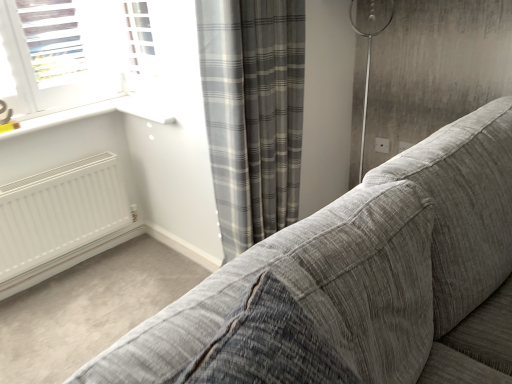
The width and height of the screenshot is (512, 384). What do you see at coordinates (382, 145) in the screenshot?
I see `matte gray outlet at upper center` at bounding box center [382, 145].

Describe the element at coordinates (253, 113) in the screenshot. The height and width of the screenshot is (384, 512). I see `gray plaid curtain at center` at that location.

You are a GUI agent. You are given a task and a screenshot of the screen. Output one action in this format:
    pyautogui.click(x=<x>, y=<y>)
    Task: Click on the textured gray fabric couch at center
    This screenshot has width=512, height=384.
    Given the screenshot: What is the action you would take?
    pyautogui.click(x=357, y=283)

From the picture: Measure the distance between gray plaid curtain at center and textured gray fabric couch at center.

gray plaid curtain at center is 79.45 centimeters from textured gray fabric couch at center.

Which is more to the right, gray plaid curtain at center or textured gray fabric couch at center?

From the viewer's perspective, gray plaid curtain at center appears more on the right side.

Which is nearer, (x=261, y=91) or (x=386, y=337)?

Point (x=386, y=337)

Where is `studio couch lying on the left of gray plaid curtain at center`? The width and height of the screenshot is (512, 384). studio couch lying on the left of gray plaid curtain at center is located at coordinates (357, 283).

From a real-world perspective, is matte gray outlet at upper center located higher than textured gray fabric couch at center?

No, from a real-world perspective, matte gray outlet at upper center is not over textured gray fabric couch at center

From their relative heights in the image, would you say matte gray outlet at upper center is taller or shorter than textured gray fabric couch at center?

In the image, matte gray outlet at upper center appears to be shorter than textured gray fabric couch at center.

From the image's perspective, is matte gray outlet at upper center on top of textured gray fabric couch at center?

Yes, from the image's perspective, matte gray outlet at upper center is over textured gray fabric couch at center.

Based on the photo, how distant is matte gray outlet at upper center from textured gray fabric couch at center?

1.48 meters.

Is textured gray fabric couch at center outside of gray plaid curtain at center?

textured gray fabric couch at center lies outside gray plaid curtain at center's area.

Measure the distance between textured gray fabric couch at center and gray plaid curtain at center.

They are 31.28 inches apart.

Consider the image. Is textured gray fabric couch at center aimed at gray plaid curtain at center?

No, textured gray fabric couch at center is not oriented towards gray plaid curtain at center.

From the picture: In the image, is textured gray fabric couch at center positioned in front of or behind gray plaid curtain at center?

textured gray fabric couch at center is in front of gray plaid curtain at center.

From a real-world perspective, which is physically below, matte gray outlet at upper center or gray plaid curtain at center?

From a 3D spatial view, matte gray outlet at upper center is below.

Considering the relative sizes of matte gray outlet at upper center and gray plaid curtain at center in the image provided, is matte gray outlet at upper center thinner than gray plaid curtain at center?

Indeed, matte gray outlet at upper center has a lesser width compared to gray plaid curtain at center.

In terms of height, does matte gray outlet at upper center look taller or shorter compared to gray plaid curtain at center?

In the image, matte gray outlet at upper center appears to be shorter than gray plaid curtain at center.

Does matte gray outlet at upper center touch gray plaid curtain at center?

No, matte gray outlet at upper center is not beside gray plaid curtain at center.

From a real-world perspective, is textured gray fabric couch at center positioned over matte gray outlet at upper center based on gravity?

Correct, in the physical world, textured gray fabric couch at center is higher than matte gray outlet at upper center.

Is point (348, 328) less distant than point (381, 144)?

Yes, it is.

Consider the image. Between textured gray fabric couch at center and matte gray outlet at upper center, which one has smaller width?

Thinner between the two is matte gray outlet at upper center.

Choose the correct answer: Is textured gray fabric couch at center inside matte gray outlet at upper center or outside it?

textured gray fabric couch at center is spatially situated outside matte gray outlet at upper center.

Consider the image. Is gray plaid curtain at center beside matte gray outlet at upper center?

No, gray plaid curtain at center is not with matte gray outlet at upper center.

Is gray plaid curtain at center further to the viewer compared to matte gray outlet at upper center?

No.

From their relative heights in the image, would you say gray plaid curtain at center is taller or shorter than matte gray outlet at upper center?

gray plaid curtain at center is taller than matte gray outlet at upper center.

Considering the positions of objects gray plaid curtain at center and matte gray outlet at upper center in the image provided, who is more to the left, gray plaid curtain at center or matte gray outlet at upper center?

Positioned to the left is gray plaid curtain at center.

Identify the location of curtain that is behind the textured gray fabric couch at center. Image resolution: width=512 pixels, height=384 pixels. (253, 113).

Find the location of a particular element. The image size is (512, 384). electric outlet that is on the right side of textured gray fabric couch at center is located at coordinates (382, 145).

Considering their positions, is gray plaid curtain at center positioned closer to textured gray fabric couch at center than matte gray outlet at upper center?

gray plaid curtain at center is closer to textured gray fabric couch at center.

Based on their spatial positions, is matte gray outlet at upper center or textured gray fabric couch at center further from gray plaid curtain at center?

The object further to gray plaid curtain at center is matte gray outlet at upper center.

Looking at the image, which one is located closer to textured gray fabric couch at center, matte gray outlet at upper center or gray plaid curtain at center?

gray plaid curtain at center lies closer to textured gray fabric couch at center than the other object.

From the image, which object appears to be farther from matte gray outlet at upper center, gray plaid curtain at center or textured gray fabric couch at center?

textured gray fabric couch at center is further to matte gray outlet at upper center.

From the picture: From the image, which object appears to be farther from gray plaid curtain at center, textured gray fabric couch at center or matte gray outlet at upper center?

matte gray outlet at upper center is further to gray plaid curtain at center.

From the image, which object appears to be farther from matte gray outlet at upper center, textured gray fabric couch at center or gray plaid curtain at center?

Based on the image, textured gray fabric couch at center appears to be further to matte gray outlet at upper center.

Identify the location of curtain between textured gray fabric couch at center and matte gray outlet at upper center from front to back. (253, 113).